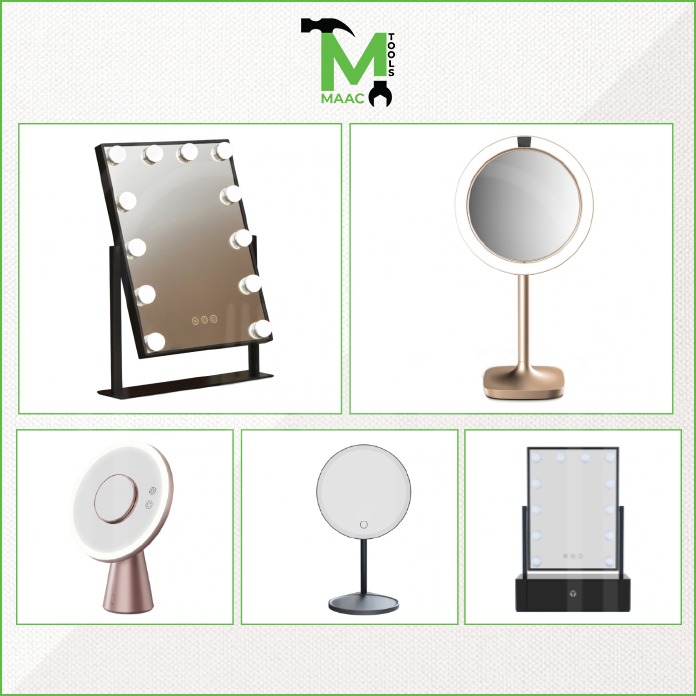
Locate an element on the screen. This screenshot has height=696, width=696. rectangle mirror with lights surrounding the edges is located at coordinates (589, 560).